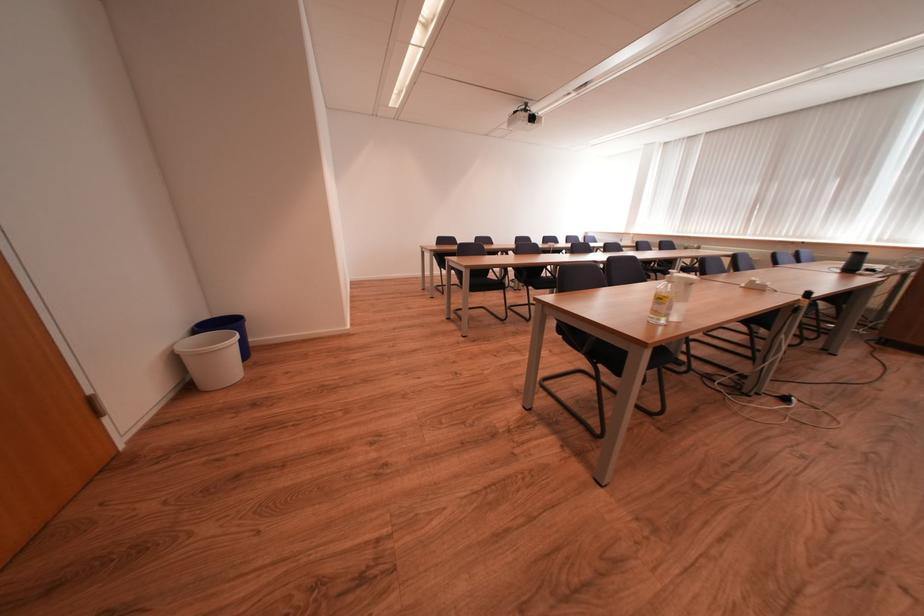
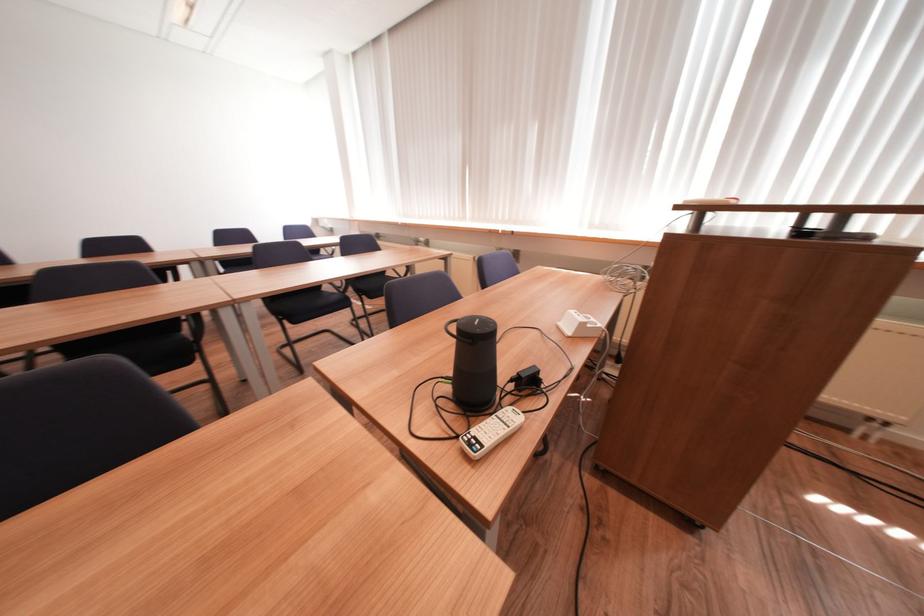
The images are taken continuously from a first-person perspective. In which direction are you moving?

The movement direction of the cameraman is right, forward.